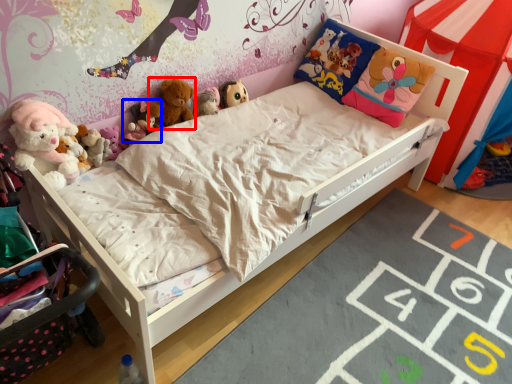
Question: Which object is closer to the camera taking this photo, toy (highlighted by a red box) or toy (highlighted by a blue box)?

Choices:
 (A) toy
 (B) toy

Answer: (B)